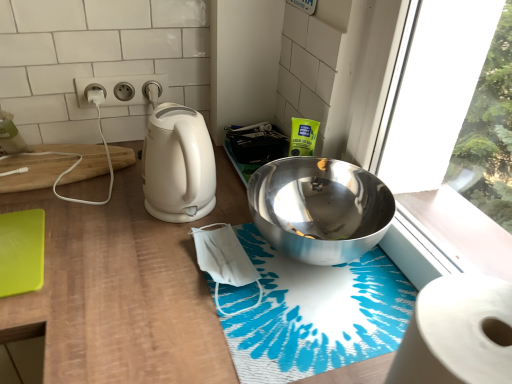
This screenshot has width=512, height=384. What are the coordinates of `vacant space underneath blue printed bath mat at center (from a real-world perspective)` in the screenshot? It's located at (318, 292).